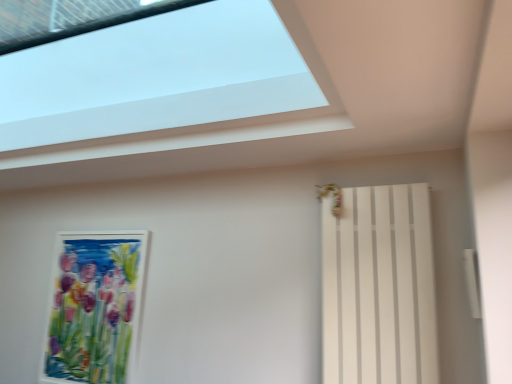
Question: Can you confirm if watercolor paper painting at left is shorter than white matte radiator at right?

Choices:
 (A) yes
 (B) no

Answer: (B)

Question: Considering the relative sizes of watercolor paper painting at left and white matte radiator at right in the image provided, is watercolor paper painting at left taller than white matte radiator at right?

Choices:
 (A) yes
 (B) no

Answer: (A)

Question: Is watercolor paper painting at left smaller than white matte radiator at right?

Choices:
 (A) no
 (B) yes

Answer: (B)

Question: Is watercolor paper painting at left not inside white matte radiator at right?

Choices:
 (A) no
 (B) yes

Answer: (B)

Question: Is watercolor paper painting at left aimed at white matte radiator at right?

Choices:
 (A) no
 (B) yes

Answer: (A)

Question: Is point (208, 112) closer or farther from the camera than point (90, 248)?

Choices:
 (A) closer
 (B) farther

Answer: (A)

Question: Do you think transparent glass window at upper center is within watercolor paper painting at left, or outside of it?

Choices:
 (A) outside
 (B) inside

Answer: (A)

Question: From a real-world perspective, is transparent glass window at upper center physically located above or below watercolor paper painting at left?

Choices:
 (A) below
 (B) above

Answer: (B)

Question: In terms of height, does transparent glass window at upper center look taller or shorter compared to watercolor paper painting at left?

Choices:
 (A) short
 (B) tall

Answer: (A)

Question: Based on their sizes in the image, would you say watercolor paper painting at left is bigger or smaller than white matte radiator at right?

Choices:
 (A) small
 (B) big

Answer: (A)

Question: Considering the positions of point (48, 374) and point (326, 231), is point (48, 374) closer or farther from the camera than point (326, 231)?

Choices:
 (A) closer
 (B) farther

Answer: (B)

Question: In the image, is watercolor paper painting at left positioned in front of or behind white matte radiator at right?

Choices:
 (A) behind
 (B) front

Answer: (A)

Question: Is watercolor paper painting at left inside the boundaries of white matte radiator at right, or outside?

Choices:
 (A) inside
 (B) outside

Answer: (B)

Question: In terms of width, does watercolor paper painting at left look wider or thinner when compared to transparent glass window at upper center?

Choices:
 (A) thin
 (B) wide

Answer: (A)

Question: Is watercolor paper painting at left to the left or to the right of transparent glass window at upper center in the image?

Choices:
 (A) right
 (B) left

Answer: (B)